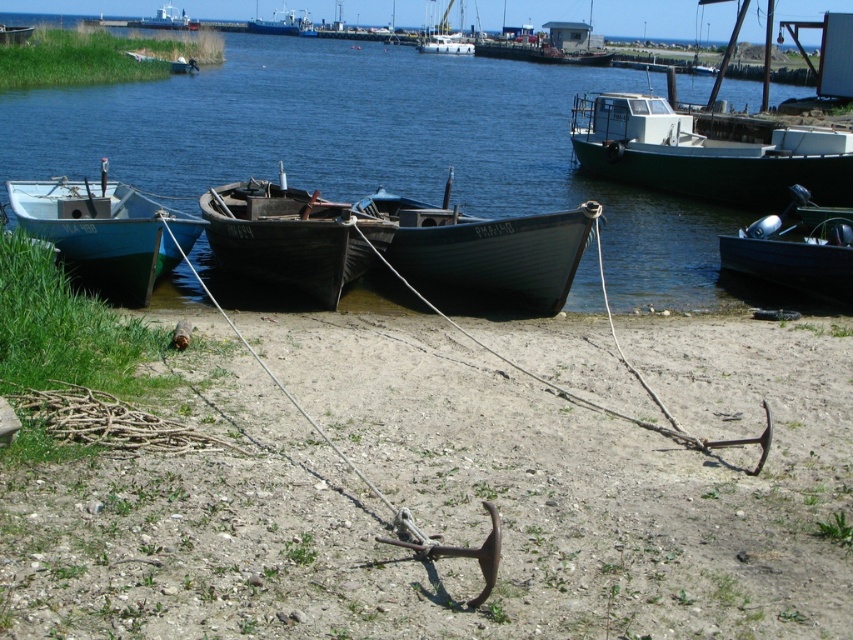
You are a crane operator tasked with moving the brown gravel anchor at lower center to the blue metallic boat at upper center. Given that the crane has a maximum reach of 400 feet, can you safely move the anchor to the boat without extending beyond the crane operator?

The brown gravel anchor at lower center and blue metallic boat at upper center are 436.69 feet apart from each other. Since the crane has a maximum reach of 400 feet, the distance between them exceeds the crane operator, so the crane cannot safely move the anchor to the boat without exceeding its maximum reach.

You are a dock worker who needs to load cargo onto both the teal matte boat at left and the blue metallic boat at upper center. Which boat will require a wider loading ramp due to its size?

The blue metallic boat at upper center requires a wider loading ramp because it has a greater width than the teal matte boat at left.

You are standing on the sandy shore and want to board the teal matte boat at left and the blue metallic boat at upper center. Which boat will require you to climb higher to board?

The blue metallic boat at upper center is taller than the teal matte boat at left, so you will need to climb higher to board the blue metallic boat at upper center.